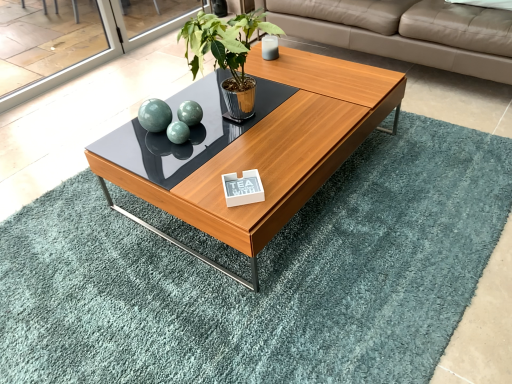
At what (x,y) coordinates should I click in order to perform the action: click on vacant space in front of wooden coffee table at center. Please return your answer as a coordinate pair (x, y). Looking at the image, I should click on (275, 301).